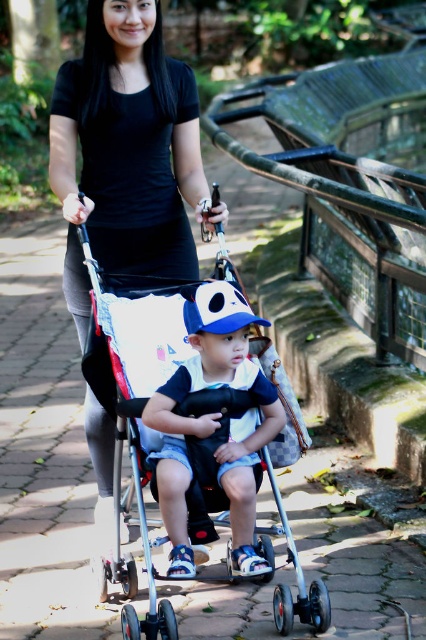
Question: Does silver metallic stroller at center have a smaller size compared to matte blue cap at center?

Choices:
 (A) no
 (B) yes

Answer: (A)

Question: Does silver metallic stroller at center have a greater width compared to matte blue cap at center?

Choices:
 (A) yes
 (B) no

Answer: (A)

Question: Estimate the real-world distances between objects in this image. Which object is farther from the black matte dress at center?

Choices:
 (A) silver metallic stroller at center
 (B) matte blue cap at center

Answer: (B)

Question: Which object is the farthest from the matte blue cap at center?

Choices:
 (A) black matte dress at center
 (B) silver metallic stroller at center

Answer: (A)

Question: Which point is closer to the camera?

Choices:
 (A) (129, 448)
 (B) (108, 449)
 (C) (221, 483)

Answer: (C)

Question: Does silver metallic stroller at center have a smaller size compared to matte blue cap at center?

Choices:
 (A) yes
 (B) no

Answer: (B)